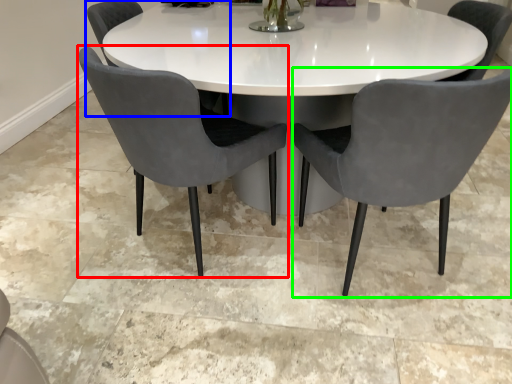
Question: Which is nearer to the chair (highlighted by a red box)? chair (highlighted by a blue box) or chair (highlighted by a green box).

Choices:
 (A) chair
 (B) chair

Answer: (B)